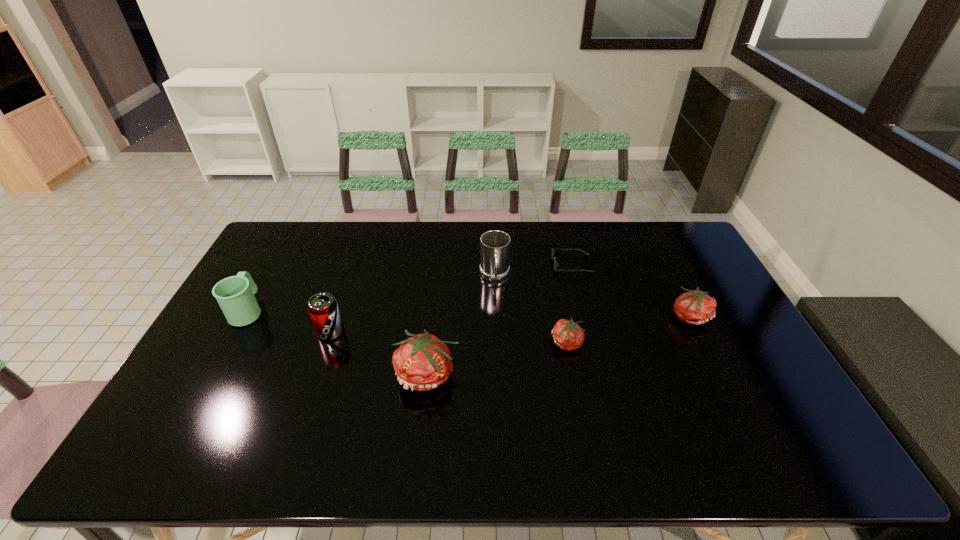
The image size is (960, 540). I want to click on free space that is in between the right mug and the second tomato from left to right, so click(531, 310).

Point out which object is positioned as the fourth nearest to the nearer mug. Please provide its 2D coordinates. Your answer should be formatted as a tuple, i.e. [(x, y)], where the tuple contains the x and y coordinates of a point satisfying the conditions above.

[(568, 335)]

The image size is (960, 540). What are the coordinates of `object identified as the fourth closest to the fifth tallest object` in the screenshot? It's located at (422, 362).

Select which tomato is the second closest to the fifth object from right to left. Please provide its 2D coordinates. Your answer should be formatted as a tuple, i.e. [(x, y)], where the tuple contains the x and y coordinates of a point satisfying the conditions above.

[(695, 307)]

You are a GUI agent. You are given a task and a screenshot of the screen. Output one action in this format:
    pyautogui.click(x=<x>, y=<y>)
    Task: Click on the tomato that is the second closest to the shortest tomato
    
    Given the screenshot: What is the action you would take?
    pyautogui.click(x=695, y=307)

Locate an element on the screen. The width and height of the screenshot is (960, 540). vacant point that satisfies the following two spatial constraints: 1. on the side of the right mug with the handle; 2. on the left side of the second tomato from left to right is located at coordinates (497, 343).

At what (x,y) coordinates should I click in order to perform the action: click on vacant space that satisfies the following two spatial constraints: 1. on the front-facing side of the sunglasses; 2. on the side of the right mug with the handle. Please return your answer as a coordinate pair (x, y). This screenshot has width=960, height=540. Looking at the image, I should click on (575, 277).

Find the location of `free location that satisfies the following two spatial constraints: 1. on the front-facing side of the shortest object; 2. on the right side of the rightmost tomato`. free location that satisfies the following two spatial constraints: 1. on the front-facing side of the shortest object; 2. on the right side of the rightmost tomato is located at coordinates (585, 316).